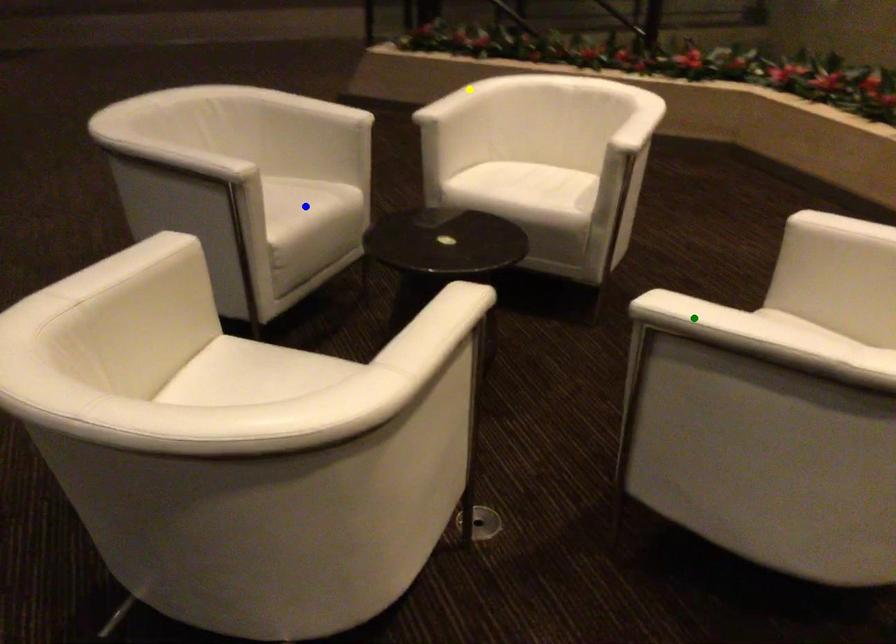
Order these from nearest to farthest:
A) green point
B) blue point
C) yellow point

yellow point < blue point < green point